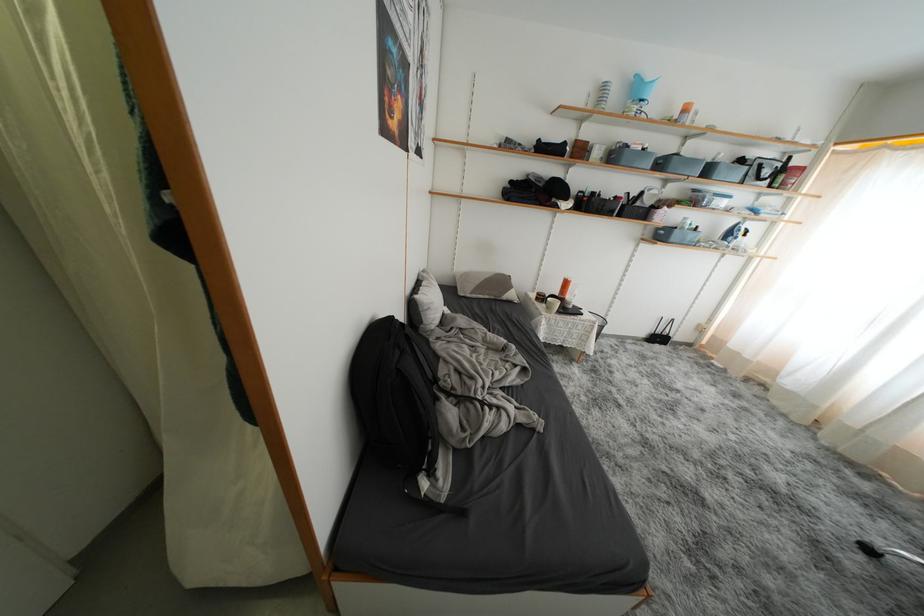
Locate an element on the screen. Image resolution: width=924 pixels, height=616 pixels. grey patterned pillow is located at coordinates (484, 285).